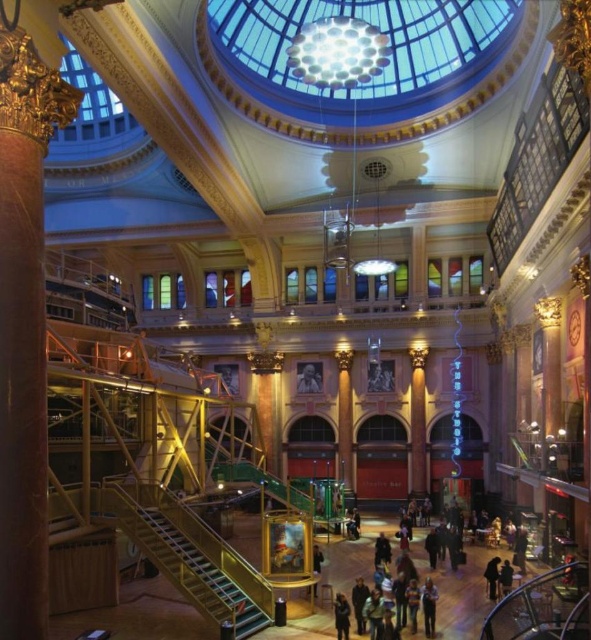
Question: Can you confirm if gold ornate column at left is wider than dark blue jacket at lower center?

Choices:
 (A) yes
 (B) no

Answer: (A)

Question: Which object is closer to the camera taking this photo?

Choices:
 (A) smooth skin face at center
 (B) dark clothing at lower right
 (C) gold ornate column at left
 (D) metallic staircase at lower center

Answer: (C)

Question: Which object is closer to the camera taking this photo?

Choices:
 (A) dark clothing at lower right
 (B) metallic staircase at lower center

Answer: (B)

Question: Is metallic staircase at lower center closer to camera compared to blue denim jeans at lower center?

Choices:
 (A) yes
 (B) no

Answer: (A)

Question: Based on their relative distances, which object is farther from the dark blue jacket at lower center?

Choices:
 (A) metallic staircase at lower center
 (B) dark clothing at lower right

Answer: (B)

Question: Where is metallic staircase at lower center located in relation to dark blue jacket at lower center in the image?

Choices:
 (A) below
 (B) above

Answer: (B)